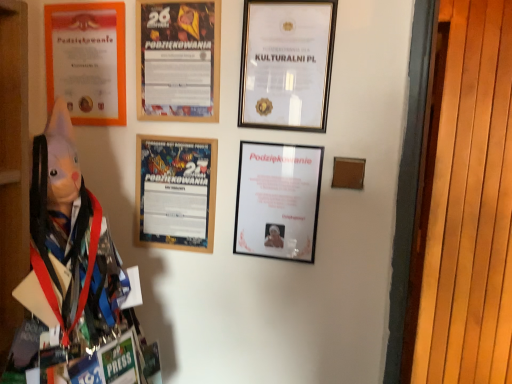
Question: Would you consider gold-framed certificate at upper center, placed as the first picture frame when sorted from right to left, to be distant from matte black picture frame at center, the third picture frame positioned from the left?

Choices:
 (A) no
 (B) yes

Answer: (A)

Question: Is gold-framed certificate at upper center, the fourth picture frame in the left-to-right sequence, further to camera compared to matte black picture frame at center, the 2th picture frame when ordered from right to left?

Choices:
 (A) no
 (B) yes

Answer: (A)

Question: From the image's perspective, would you say gold-framed certificate at upper center, placed as the first picture frame when sorted from right to left, is shown under matte black picture frame at center, the third picture frame positioned from the left?

Choices:
 (A) yes
 (B) no

Answer: (B)

Question: Can you confirm if gold-framed certificate at upper center, the fourth picture frame in the left-to-right sequence, is positioned to the right of matte black picture frame at center, the third picture frame positioned from the left?

Choices:
 (A) yes
 (B) no

Answer: (A)

Question: Is gold-framed certificate at upper center, the fourth picture frame in the left-to-right sequence, oriented away from matte black picture frame at center, the 2th picture frame when ordered from right to left?

Choices:
 (A) yes
 (B) no

Answer: (B)

Question: Is wooden framed poster at center, which is counted as the 2th picture frame, starting from the left, inside or outside of matte black picture frame at center, the third picture frame positioned from the left?

Choices:
 (A) inside
 (B) outside

Answer: (B)

Question: From their relative heights in the image, would you say wooden framed poster at center, which is counted as the 2th picture frame, starting from the left, is taller or shorter than matte black picture frame at center, the third picture frame positioned from the left?

Choices:
 (A) tall
 (B) short

Answer: (B)

Question: Is point (209, 210) positioned closer to the camera than point (270, 221)?

Choices:
 (A) closer
 (B) farther

Answer: (B)

Question: Based on their positions, is wooden framed poster at center, which is counted as the 2th picture frame, starting from the left, located to the left or right of matte black picture frame at center, the 2th picture frame when ordered from right to left?

Choices:
 (A) right
 (B) left

Answer: (B)

Question: Based on their sizes in the image, would you say matte paper poster at center is bigger or smaller than matte orange certificate at upper left, the first picture frame from the left?

Choices:
 (A) big
 (B) small

Answer: (B)

Question: Does point (183, 31) appear closer or farther from the camera than point (96, 79)?

Choices:
 (A) farther
 (B) closer

Answer: (B)

Question: From the image's perspective, relative to matte orange certificate at upper left, the first picture frame from the left, is matte paper poster at center above or below?

Choices:
 (A) above
 (B) below

Answer: (B)

Question: Which is correct: matte paper poster at center is inside matte orange certificate at upper left, the fourth picture frame in the right-to-left sequence, or outside of it?

Choices:
 (A) inside
 (B) outside

Answer: (B)

Question: Looking at their shapes, would you say wooden framed poster at center, positioned as the 3th picture frame in right-to-left order, is wider or thinner than gold-framed certificate at upper center, placed as the first picture frame when sorted from right to left?

Choices:
 (A) wide
 (B) thin

Answer: (B)

Question: Considering the relative positions of wooden framed poster at center, positioned as the 3th picture frame in right-to-left order, and gold-framed certificate at upper center, the fourth picture frame in the left-to-right sequence, in the image provided, is wooden framed poster at center, positioned as the 3th picture frame in right-to-left order, to the left or to the right of gold-framed certificate at upper center, the fourth picture frame in the left-to-right sequence,?

Choices:
 (A) left
 (B) right

Answer: (A)